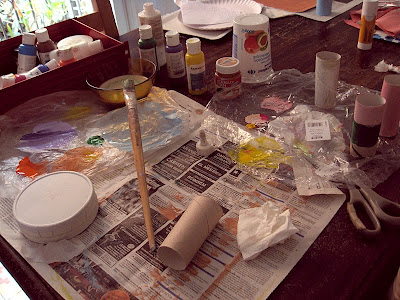
Find the location of a particular element. bottles is located at coordinates (195, 62), (178, 62), (156, 53), (153, 25), (367, 27), (42, 48), (25, 57), (14, 76), (36, 73), (64, 62).